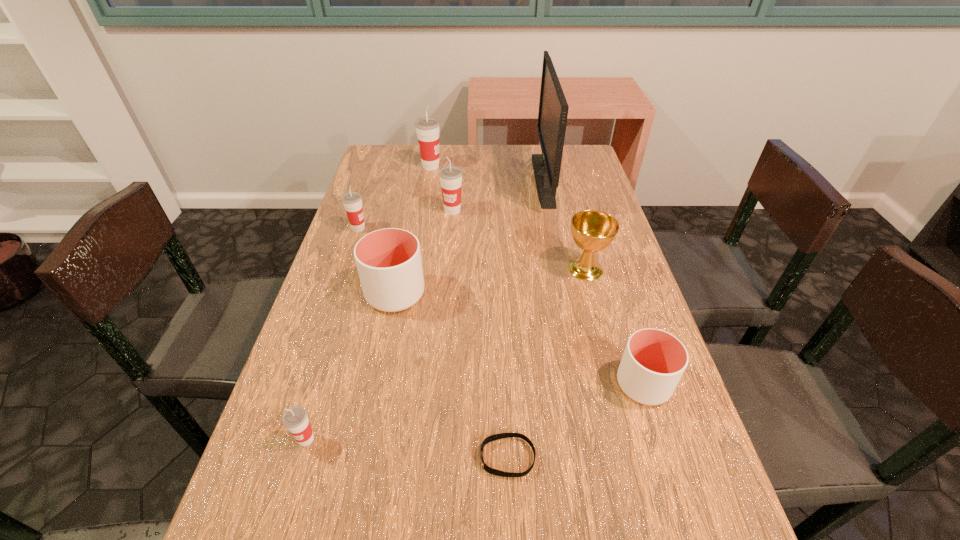
Find the location of a particular element. The image size is (960, 540). cup at the far edge is located at coordinates (427, 128).

Image resolution: width=960 pixels, height=540 pixels. What are the coordinates of `monitor that is at the right edge` in the screenshot? It's located at (553, 108).

This screenshot has height=540, width=960. I want to click on chalice positioned at the right edge, so click(x=592, y=230).

Where is `cup at the right edge`? cup at the right edge is located at coordinates (653, 362).

This screenshot has height=540, width=960. I want to click on object present at the far right corner, so click(x=553, y=108).

In the image, there is a desktop. At what (x,y) coordinates should I click in order to perform the action: click on free space at the far edge. Please return your answer as a coordinate pair (x, y). Looking at the image, I should click on (417, 167).

Where is `vacant space at the left edge of the desktop`? This screenshot has width=960, height=540. vacant space at the left edge of the desktop is located at coordinates (399, 212).

Identify the location of vacant region at the right edge. This screenshot has width=960, height=540. (629, 449).

Locate an element on the screen. The image size is (960, 540). free space between the gold chalice and the right white cup is located at coordinates [614, 327].

Where is `vacant space that's between the gold chalice and the sixth object from left to right`? The image size is (960, 540). vacant space that's between the gold chalice and the sixth object from left to right is located at coordinates (546, 363).